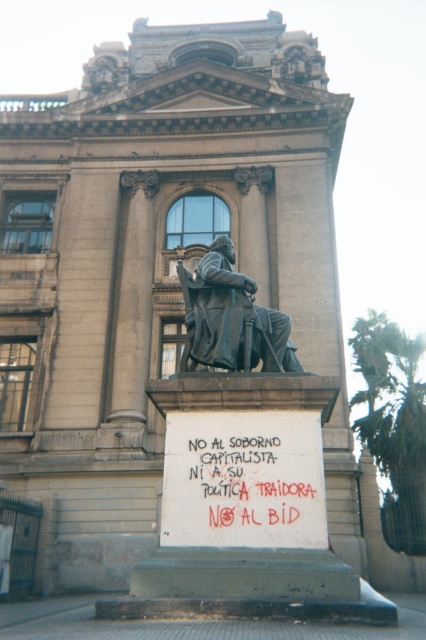
Can you confirm if red graffiti at center is thinner than green leafy palm tree at right?

Yes.

Locate an element on the screen. This screenshot has height=640, width=426. red graffiti at center is located at coordinates [255, 483].

Is red graffiti at center shorter than bronze statue at center?

Indeed, red graffiti at center has a lesser height compared to bronze statue at center.

Which is more to the left, red graffiti at center or bronze statue at center?

bronze statue at center is more to the left.

Is point (232, 467) less distant than point (253, 291)?

That is True.

Locate an element on the screen. red graffiti at center is located at coordinates (255, 483).

Between green leafy palm tree at right and bronze statue at center, which one appears on the right side from the viewer's perspective?

From the viewer's perspective, green leafy palm tree at right appears more on the right side.

Is green leafy palm tree at right taller than bronze statue at center?

Yes.

Identify the location of green leafy palm tree at right. (394, 422).